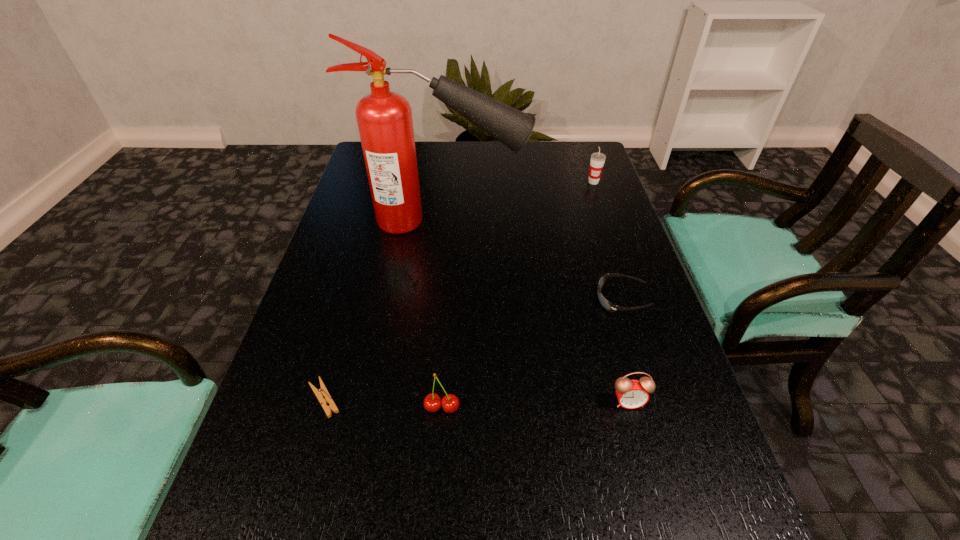
In order to click on fire extinguisher in this screenshot , I will do `click(384, 118)`.

This screenshot has width=960, height=540. Identify the location of the second farthest object. (384, 118).

Where is `the second tallest object`? The image size is (960, 540). the second tallest object is located at coordinates (597, 161).

Where is `the farthest object`? the farthest object is located at coordinates (597, 161).

Where is `cherry`? cherry is located at coordinates (432, 402).

The image size is (960, 540). Find the location of `alarm clock`. alarm clock is located at coordinates (631, 394).

The width and height of the screenshot is (960, 540). I want to click on the third farthest object, so click(x=606, y=304).

You are a GUI agent. You are given a task and a screenshot of the screen. Output one action in this format:
    pyautogui.click(x=<x>, y=<y>)
    Task: Click on the second shortest object
    The image size is (960, 540).
    Given the screenshot: What is the action you would take?
    pyautogui.click(x=606, y=304)

Identify the location of clothespin. (322, 391).

At what (x,y) coordinates should I click in order to perform the action: click on vacant point located at the nozzle of the second farthest object. Please return your answer as a coordinate pair (x, y). This screenshot has height=540, width=960. Looking at the image, I should click on (574, 221).